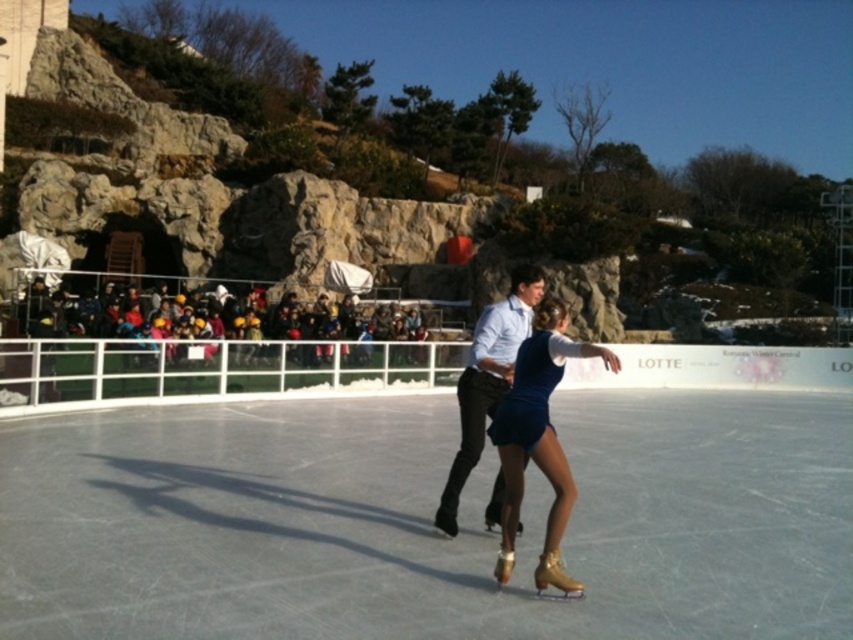
Question: Can you confirm if shiny gold ice skate at center is thinner than gold metallic ice skate at lower center?

Choices:
 (A) yes
 (B) no

Answer: (A)

Question: Which of these objects is positioned farthest from the matte blue shirt at center?

Choices:
 (A) white ice skating rink at center
 (B) gold metallic ice skate at center

Answer: (A)

Question: Which point is closer to the camera?

Choices:
 (A) shiny gold ice skate at center
 (B) white ice skating rink at center

Answer: (B)

Question: Is the position of matte blue shirt at center more distant than that of gold metallic ice skate at lower center?

Choices:
 (A) yes
 (B) no

Answer: (A)

Question: Which point is closer to the camera?

Choices:
 (A) (514, 532)
 (B) (453, 528)
 (C) (535, 547)
 (D) (563, 580)

Answer: (D)

Question: Where is white ice skating rink at center located in relation to gold metallic ice skate at lower center in the image?

Choices:
 (A) right
 (B) left

Answer: (B)